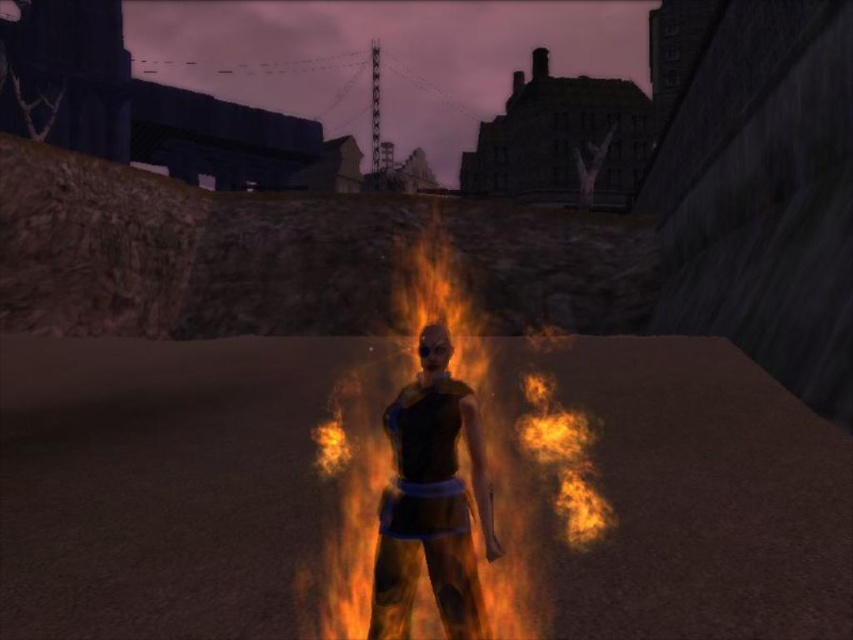
Is flaming orange flames at center closer to camera compared to shiny black armor at center?

No, flaming orange flames at center is further to the viewer.

Between flaming orange flames at center and shiny black armor at center, which one has more height?

With more height is flaming orange flames at center.

Does point (531, 634) lie behind point (465, 618)?

Yes, it is.

The image size is (853, 640). What are the coordinates of `flaming orange flames at center` in the screenshot? It's located at (440, 476).